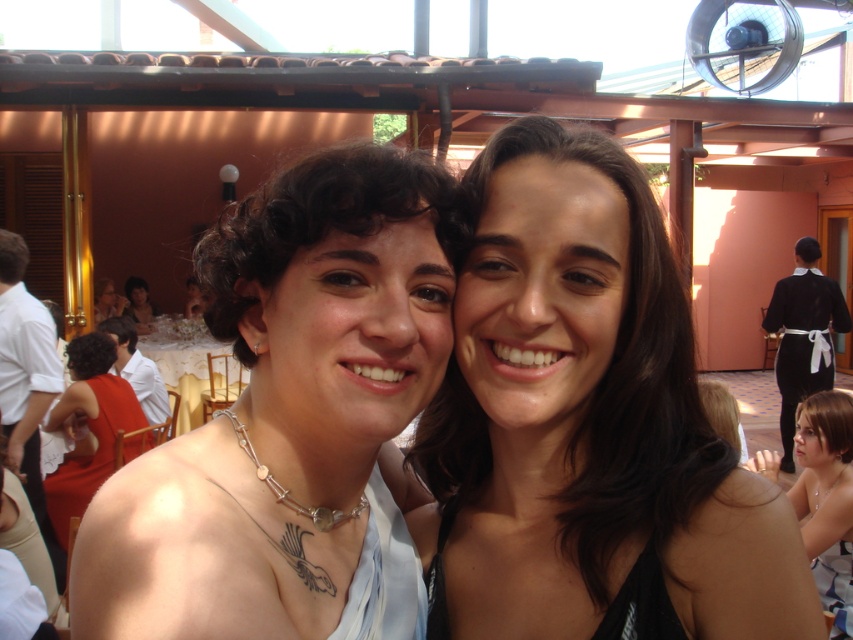
You are a photographer at this event and need to ensure the two people at the center are in focus. Given that your camera has a depth of field that can cover 38 inches, will both smooth black hair at center be in focus?

The two people at the center are 37.41 inches apart, which is within the camera depth of field of 38 inches. Therefore, both smooth black hair at center will be in focus.

You are a photographer at this event and want to ensure both the matte silver necklace at center and the dark brown hair at center are clearly visible in your photo. Given their sizes, which object should you focus on to ensure clarity, and why?

The matte silver necklace at center has a larger size compared to the dark brown hair at center, so focusing on the matte silver necklace at center will ensure both are in focus since it is the larger object.

You are a photographer at the event and want to place a small decorative item at point (x=88, y=426). What is the best object to place it on?

The point (x=88, y=426) is on the matte red dress at left, so placing the decorative item there would be appropriate.